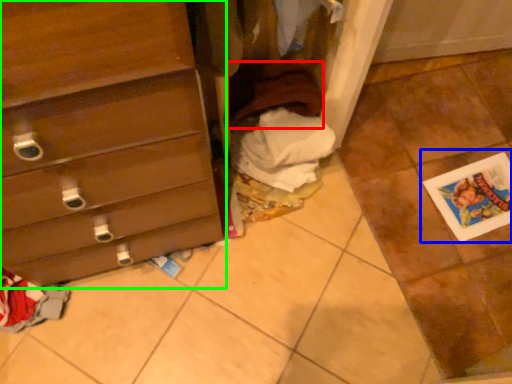
Question: Which object is positioned closest to clothing (highlighted by a red box)? Select from postcard (highlighted by a blue box) and chest of drawers (highlighted by a green box).

Choices:
 (A) postcard
 (B) chest of drawers

Answer: (B)